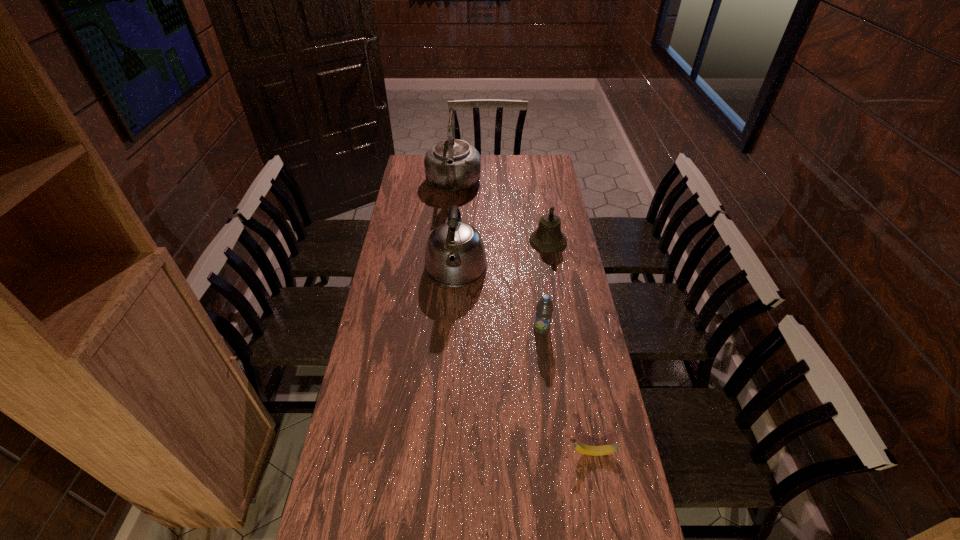
Find the location of a particular element. Image resolution: width=960 pixels, height=540 pixels. free point between the shorter kettle and the bell is located at coordinates (502, 255).

Identify which object is located as the second nearest to the fourth shortest object. Please provide its 2D coordinates. Your answer should be formatted as a tuple, i.e. [(x, y)], where the tuple contains the x and y coordinates of a point satisfying the conditions above.

[(544, 308)]

Point out which object is positioned as the fourth nearest to the bell. Please provide its 2D coordinates. Your answer should be formatted as a tuple, i.e. [(x, y)], where the tuple contains the x and y coordinates of a point satisfying the conditions above.

[(579, 447)]

Image resolution: width=960 pixels, height=540 pixels. Identify the location of free space that satisfies the following two spatial constraints: 1. on the spout of the shorter kettle; 2. on the right side of the second nearest object. (452, 329).

This screenshot has height=540, width=960. I want to click on blank space that satisfies the following two spatial constraints: 1. at the spout of the bell; 2. on the right side of the farther kettle, so tap(448, 241).